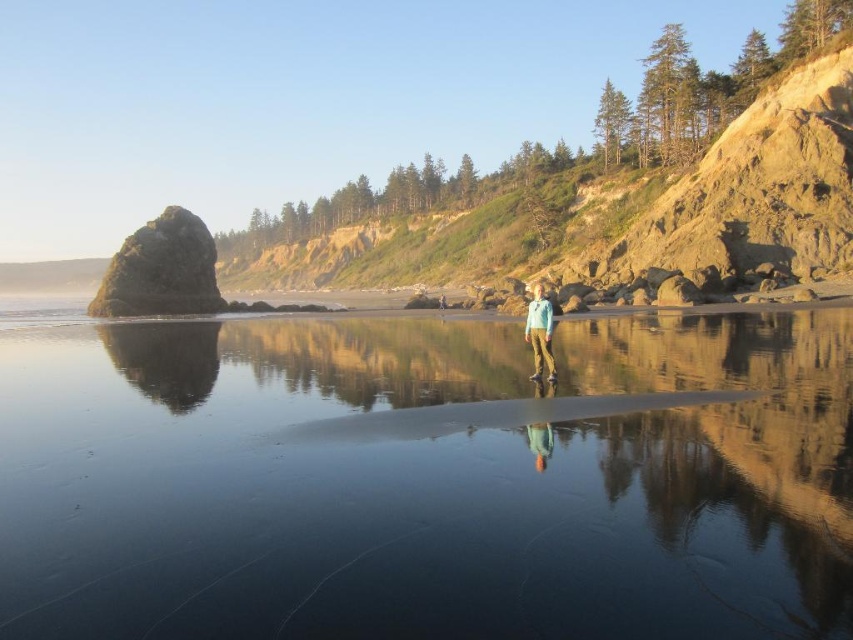
You are a photographer trying to capture the reflection of the rock formation in the water. You notice the matte blue jacket at center might be blocking the reflection. Can you determine if the glossy reflective water at center is large enough to accommodate the reflection without the jacket obstructing it?

The glossy reflective water at center is larger in size than the matte blue jacket at center, so the water should be large enough to reflect the rock formation without the jacket obstructing it.

You are standing on the beach in the scene and want to reach the point marked as point (426, 480). Since the water is reflective, will you be able to see your reflection when you arrive there?

The point (426, 480) is on glossy reflective water at center, so yes, you will be able to see your reflection there because the water is reflective.